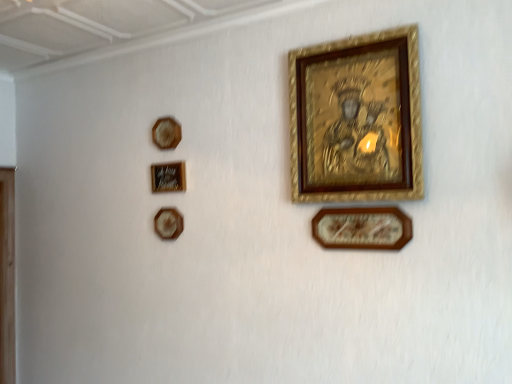
Describe the element at coordinates (168, 223) in the screenshot. I see `matte brown picture frame at upper left, the fourth picture frame when ordered from right to left` at that location.

This screenshot has height=384, width=512. What do you see at coordinates (166, 133) in the screenshot? I see `wooden plaque at upper left, placed as the 5th picture frame when sorted from right to left` at bounding box center [166, 133].

Find the location of a particular element. matte black picture frame at upper left, the 3th picture frame when ordered from left to right is located at coordinates pos(168,177).

Image resolution: width=512 pixels, height=384 pixels. What do you see at coordinates (357, 119) in the screenshot?
I see `gold textured picture frame at upper center, which ranks as the 4th picture frame in left-to-right order` at bounding box center [357, 119].

Image resolution: width=512 pixels, height=384 pixels. I want to click on matte brown picture frame at upper left, acting as the 2th picture frame starting from the left, so click(x=168, y=223).

In the scene shown: Considering the sizes of objects matte black picture frame at upper left, the 3th picture frame when ordered from left to right, and gold textured picture frame at upper center, which ranks as the 4th picture frame in left-to-right order, in the image provided, who is thinner, matte black picture frame at upper left, the 3th picture frame when ordered from left to right, or gold textured picture frame at upper center, which ranks as the 4th picture frame in left-to-right order,?

Thinner between the two is matte black picture frame at upper left, the 3th picture frame when ordered from left to right.

Based on the photo, is gold textured picture frame at upper center, which ranks as the 4th picture frame in left-to-right order, a part of matte black picture frame at upper left, the 3th picture frame when ordered from left to right?

Definitely not — gold textured picture frame at upper center, which ranks as the 4th picture frame in left-to-right order, is not inside matte black picture frame at upper left, the 3th picture frame when ordered from left to right.

How different are the orientations of matte black picture frame at upper left, the 3th picture frame when ordered from left to right, and gold textured picture frame at upper center, positioned as the second picture frame in right-to-left order, in degrees?

They differ by 0.642 degrees in their facing directions.

Who is taller, wooden picture frame at lower center, placed as the first picture frame when sorted from right to left, or matte brown picture frame at upper left, acting as the 2th picture frame starting from the left?

With more height is wooden picture frame at lower center, placed as the first picture frame when sorted from right to left.

From the image's perspective, is wooden picture frame at lower center, placed as the first picture frame when sorted from right to left, positioned above or below matte brown picture frame at upper left, acting as the 2th picture frame starting from the left?

Based on their image positions, wooden picture frame at lower center, placed as the first picture frame when sorted from right to left, is located above matte brown picture frame at upper left, acting as the 2th picture frame starting from the left.

From a real-world perspective, is wooden picture frame at lower center, placed as the first picture frame when sorted from right to left, located beneath matte brown picture frame at upper left, acting as the 2th picture frame starting from the left?

Yes, from a real-world perspective, wooden picture frame at lower center, placed as the first picture frame when sorted from right to left, is under matte brown picture frame at upper left, acting as the 2th picture frame starting from the left.

Which object is thinner, wooden picture frame at lower center, which is counted as the fifth picture frame, starting from the left, or matte brown picture frame at upper left, the fourth picture frame when ordered from right to left?

matte brown picture frame at upper left, the fourth picture frame when ordered from right to left, is thinner.

Which picture frame is the 2nd one when counting from the front of the wooden plaque at upper left, the first picture frame viewed from the left? Please provide its 2D coordinates.

[(362, 228)]

Is wooden plaque at upper left, the first picture frame viewed from the left, positioned beyond the bounds of wooden picture frame at lower center, placed as the first picture frame when sorted from right to left?

Yes, wooden plaque at upper left, the first picture frame viewed from the left, is located beyond the bounds of wooden picture frame at lower center, placed as the first picture frame when sorted from right to left.

Is point (172, 135) positioned behind point (360, 246)?

That is True.

From the image's perspective, is wooden plaque at upper left, placed as the 5th picture frame when sorted from right to left, located beneath wooden picture frame at lower center, placed as the first picture frame when sorted from right to left?

Incorrect, from the image's perspective, wooden plaque at upper left, placed as the 5th picture frame when sorted from right to left, is higher than wooden picture frame at lower center, placed as the first picture frame when sorted from right to left.

Could you tell me if gold textured picture frame at upper center, which ranks as the 4th picture frame in left-to-right order, is facing wooden plaque at upper left, placed as the 5th picture frame when sorted from right to left?

No, gold textured picture frame at upper center, which ranks as the 4th picture frame in left-to-right order, is not turned towards wooden plaque at upper left, placed as the 5th picture frame when sorted from right to left.

Considering the points (298, 129) and (170, 126), which point is behind, point (298, 129) or point (170, 126)?

The point (170, 126) is behind.

Is gold textured picture frame at upper center, which ranks as the 4th picture frame in left-to-right order, to the left or to the right of wooden plaque at upper left, placed as the 5th picture frame when sorted from right to left, in the image?

gold textured picture frame at upper center, which ranks as the 4th picture frame in left-to-right order, is positioned on wooden plaque at upper left, placed as the 5th picture frame when sorted from right to left,'s right side.

Is there a large distance between gold textured picture frame at upper center, positioned as the second picture frame in right-to-left order, and wooden plaque at upper left, the first picture frame viewed from the left?

Actually, gold textured picture frame at upper center, positioned as the second picture frame in right-to-left order, and wooden plaque at upper left, the first picture frame viewed from the left, are a little close together.

Is wooden plaque at upper left, the first picture frame viewed from the left, wider or thinner than gold textured picture frame at upper center, which ranks as the 4th picture frame in left-to-right order?

wooden plaque at upper left, the first picture frame viewed from the left, is thinner than gold textured picture frame at upper center, which ranks as the 4th picture frame in left-to-right order.

Is wooden plaque at upper left, the first picture frame viewed from the left, next to gold textured picture frame at upper center, which ranks as the 4th picture frame in left-to-right order, and touching it?

No, wooden plaque at upper left, the first picture frame viewed from the left, is not beside gold textured picture frame at upper center, which ranks as the 4th picture frame in left-to-right order.

Considering the sizes of objects wooden plaque at upper left, placed as the 5th picture frame when sorted from right to left, and gold textured picture frame at upper center, which ranks as the 4th picture frame in left-to-right order, in the image provided, who is shorter, wooden plaque at upper left, placed as the 5th picture frame when sorted from right to left, or gold textured picture frame at upper center, which ranks as the 4th picture frame in left-to-right order,?

With less height is wooden plaque at upper left, placed as the 5th picture frame when sorted from right to left.

Does wooden picture frame at lower center, which is counted as the fifth picture frame, starting from the left, lie behind wooden plaque at upper left, the first picture frame viewed from the left?

That is False.

Is wooden picture frame at lower center, which is counted as the fifth picture frame, starting from the left, bigger or smaller than wooden plaque at upper left, the first picture frame viewed from the left?

In the image, wooden picture frame at lower center, which is counted as the fifth picture frame, starting from the left, appears to be larger than wooden plaque at upper left, the first picture frame viewed from the left.

Is wooden picture frame at lower center, placed as the first picture frame when sorted from right to left, taller or shorter than wooden plaque at upper left, the first picture frame viewed from the left?

Clearly, wooden picture frame at lower center, placed as the first picture frame when sorted from right to left, is taller compared to wooden plaque at upper left, the first picture frame viewed from the left.

Could wooden plaque at upper left, the first picture frame viewed from the left, be considered to be inside wooden picture frame at lower center, placed as the first picture frame when sorted from right to left?

Definitely not — wooden plaque at upper left, the first picture frame viewed from the left, is not inside wooden picture frame at lower center, placed as the first picture frame when sorted from right to left.

Between gold textured picture frame at upper center, which ranks as the 4th picture frame in left-to-right order, and matte brown picture frame at upper left, the fourth picture frame when ordered from right to left, which one is positioned behind?

Positioned behind is matte brown picture frame at upper left, the fourth picture frame when ordered from right to left.

Is gold textured picture frame at upper center, which ranks as the 4th picture frame in left-to-right order, aimed at matte brown picture frame at upper left, the fourth picture frame when ordered from right to left?

No, gold textured picture frame at upper center, which ranks as the 4th picture frame in left-to-right order, does not turn towards matte brown picture frame at upper left, the fourth picture frame when ordered from right to left.

Which object is positioned more to the left, gold textured picture frame at upper center, positioned as the second picture frame in right-to-left order, or matte brown picture frame at upper left, acting as the 2th picture frame starting from the left?

matte brown picture frame at upper left, acting as the 2th picture frame starting from the left.

Is gold textured picture frame at upper center, positioned as the second picture frame in right-to-left order, completely or partially outside of matte brown picture frame at upper left, acting as the 2th picture frame starting from the left?

Yes, gold textured picture frame at upper center, positioned as the second picture frame in right-to-left order, is not within matte brown picture frame at upper left, acting as the 2th picture frame starting from the left.

From the image's perspective, count 1st picture frames upward from the matte black picture frame at upper left, the 3th picture frame in the right-to-left sequence, and point to it. Please provide its 2D coordinates.

[(357, 119)]

You are a GUI agent. You are given a task and a screenshot of the screen. Output one action in this format:
    pyautogui.click(x=<x>, y=<y>)
    Task: Click on the picture frame directly beneath the matte brown picture frame at upper left, acting as the 2th picture frame starting from the left (from a real-world perspective)
    Image resolution: width=512 pixels, height=384 pixels.
    Given the screenshot: What is the action you would take?
    pyautogui.click(x=362, y=228)

From the image, which object appears to be farther from wooden picture frame at lower center, placed as the first picture frame when sorted from right to left, wooden plaque at upper left, placed as the 5th picture frame when sorted from right to left, or gold textured picture frame at upper center, which ranks as the 4th picture frame in left-to-right order?

Among the two, wooden plaque at upper left, placed as the 5th picture frame when sorted from right to left, is located further to wooden picture frame at lower center, placed as the first picture frame when sorted from right to left.

Considering their positions, is matte brown picture frame at upper left, acting as the 2th picture frame starting from the left, positioned closer to wooden picture frame at lower center, which is counted as the fifth picture frame, starting from the left, than matte black picture frame at upper left, the 3th picture frame when ordered from left to right?

Among the two, matte black picture frame at upper left, the 3th picture frame when ordered from left to right, is located nearer to wooden picture frame at lower center, which is counted as the fifth picture frame, starting from the left.

Estimate the real-world distances between objects in this image. Which object is further from matte black picture frame at upper left, the 3th picture frame in the right-to-left sequence, matte brown picture frame at upper left, the fourth picture frame when ordered from right to left, or wooden plaque at upper left, the first picture frame viewed from the left?

matte brown picture frame at upper left, the fourth picture frame when ordered from right to left, is positioned further to the anchor matte black picture frame at upper left, the 3th picture frame in the right-to-left sequence.

Looking at this image, looking at the image, which one is located closer to matte brown picture frame at upper left, acting as the 2th picture frame starting from the left, gold textured picture frame at upper center, positioned as the second picture frame in right-to-left order, or wooden plaque at upper left, placed as the 5th picture frame when sorted from right to left?

The object closer to matte brown picture frame at upper left, acting as the 2th picture frame starting from the left, is wooden plaque at upper left, placed as the 5th picture frame when sorted from right to left.

Considering their positions, is gold textured picture frame at upper center, which ranks as the 4th picture frame in left-to-right order, positioned further to matte brown picture frame at upper left, acting as the 2th picture frame starting from the left, than wooden picture frame at lower center, which is counted as the fifth picture frame, starting from the left?

Among the two, gold textured picture frame at upper center, which ranks as the 4th picture frame in left-to-right order, is located further to matte brown picture frame at upper left, acting as the 2th picture frame starting from the left.

Estimate the real-world distances between objects in this image. Which object is closer to wooden plaque at upper left, the first picture frame viewed from the left, gold textured picture frame at upper center, positioned as the second picture frame in right-to-left order, or wooden picture frame at lower center, which is counted as the fifth picture frame, starting from the left?

gold textured picture frame at upper center, positioned as the second picture frame in right-to-left order, is closer to wooden plaque at upper left, the first picture frame viewed from the left.

Looking at the image, which one is located further to matte black picture frame at upper left, the 3th picture frame in the right-to-left sequence, wooden picture frame at lower center, placed as the first picture frame when sorted from right to left, or matte brown picture frame at upper left, the fourth picture frame when ordered from right to left?

Among the two, wooden picture frame at lower center, placed as the first picture frame when sorted from right to left, is located further to matte black picture frame at upper left, the 3th picture frame in the right-to-left sequence.

Which object lies nearer to the anchor point wooden plaque at upper left, placed as the 5th picture frame when sorted from right to left, matte brown picture frame at upper left, the fourth picture frame when ordered from right to left, or matte black picture frame at upper left, the 3th picture frame in the right-to-left sequence?

matte black picture frame at upper left, the 3th picture frame in the right-to-left sequence, is closer to wooden plaque at upper left, placed as the 5th picture frame when sorted from right to left.

Find the location of a particular element. picture frame between matte brown picture frame at upper left, the fourth picture frame when ordered from right to left, and gold textured picture frame at upper center, which ranks as the 4th picture frame in left-to-right order is located at coordinates (168, 177).

Locate an element on the screen. picture frame between matte black picture frame at upper left, the 3th picture frame when ordered from left to right, and wooden picture frame at lower center, placed as the first picture frame when sorted from right to left is located at coordinates (357, 119).